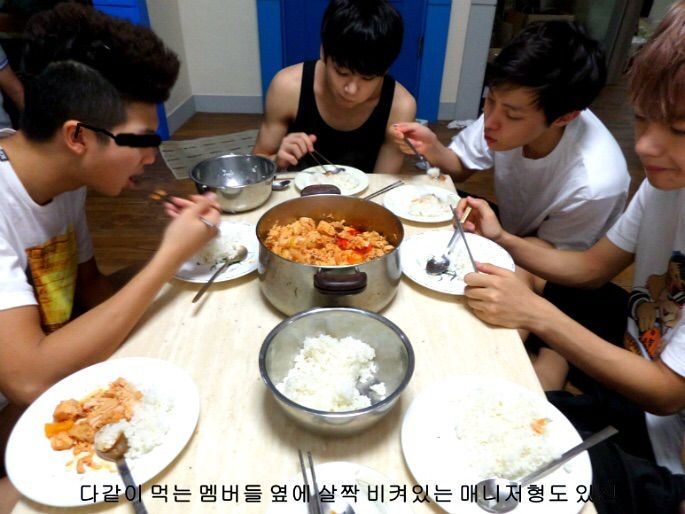
Identify the location of wood floor. (125, 241).